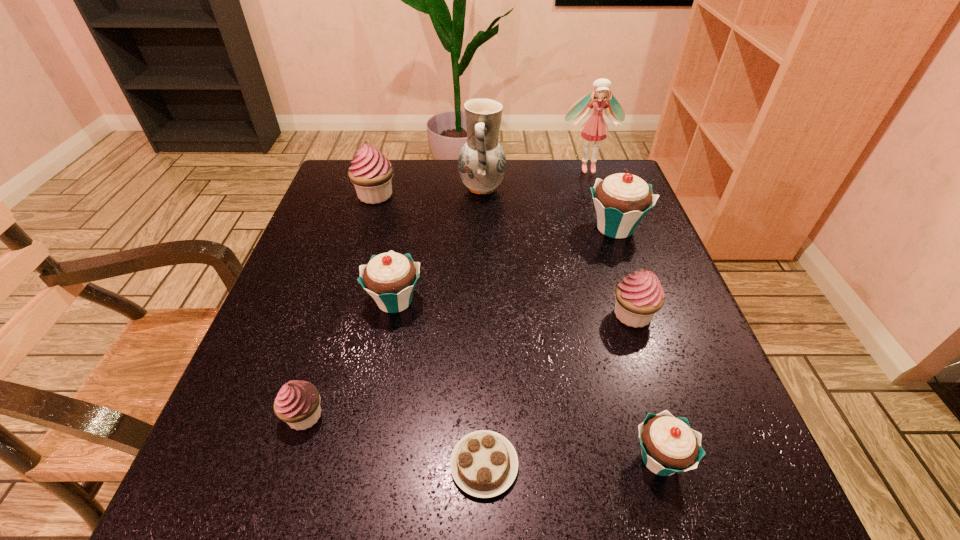
This screenshot has height=540, width=960. Identify the location of object at the far left corner. (371, 172).

Find the location of a particular element. The width and height of the screenshot is (960, 540). object that is at the far right corner is located at coordinates (595, 128).

Find the location of a particular element. object that is at the near right corner is located at coordinates (669, 445).

The image size is (960, 540). In the image, there is a desktop. In order to click on free space at the far edge in this screenshot , I will do `click(516, 210)`.

This screenshot has height=540, width=960. Identify the location of vacant space at the near edge of the desktop. (597, 523).

Image resolution: width=960 pixels, height=540 pixels. Identify the location of free location at the left edge. (233, 403).

Locate an element on the screen. vacant space at the right edge of the desktop is located at coordinates (682, 319).

Where is `vacant area at the near left corner of the desktop`? This screenshot has width=960, height=540. vacant area at the near left corner of the desktop is located at coordinates (205, 521).

Find the location of `free space between the pottery and the rightmost pink cupcake`. free space between the pottery and the rightmost pink cupcake is located at coordinates (558, 252).

What are the coordinates of `free space that is in between the farthest pink cupcake and the pottery` in the screenshot? It's located at point(429,192).